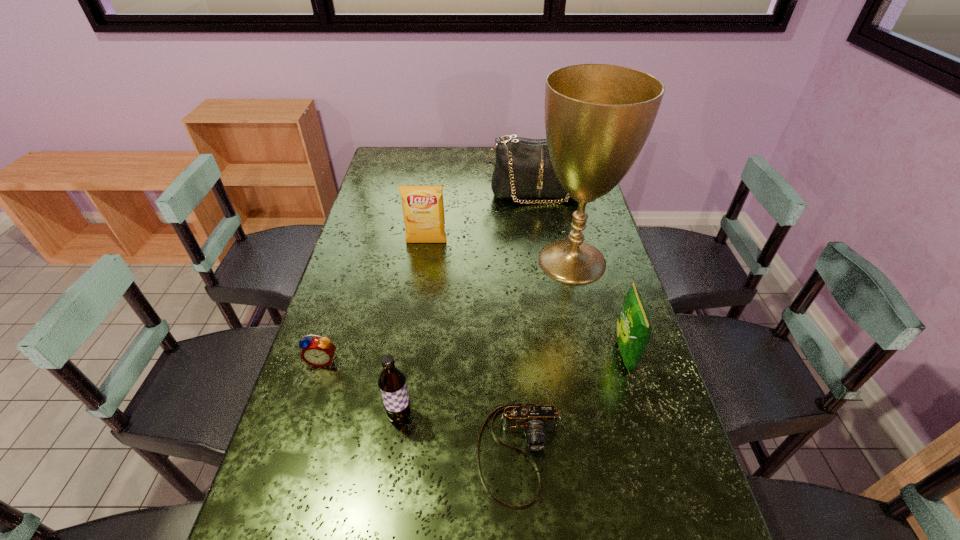
The width and height of the screenshot is (960, 540). I want to click on blank region between the right crisp (potato chip) and the trophy cup, so click(598, 307).

Where is `empty location between the left crisp (potato chip) and the shorter crisp (potato chip)`? This screenshot has width=960, height=540. empty location between the left crisp (potato chip) and the shorter crisp (potato chip) is located at coordinates (525, 299).

The height and width of the screenshot is (540, 960). What are the coordinates of `vacant space in between the handbag and the sixth tallest object` in the screenshot? It's located at pos(429,277).

Locate an element on the screen. The width and height of the screenshot is (960, 540). vacant area that lies between the nearer crisp (potato chip) and the tallest object is located at coordinates (598, 307).

I want to click on the fourth closest object to the shorter crisp (potato chip), so click(x=423, y=209).

Image resolution: width=960 pixels, height=540 pixels. In order to click on object that is the fifth closest one to the root beer in this screenshot , I will do `click(423, 209)`.

Where is `free space that satisfies the following two spatial constraints: 1. on the front-facing side of the nearer crisp (potato chip); 2. on the front-facing side of the leftmost object`? Image resolution: width=960 pixels, height=540 pixels. free space that satisfies the following two spatial constraints: 1. on the front-facing side of the nearer crisp (potato chip); 2. on the front-facing side of the leftmost object is located at coordinates (626, 360).

You are a GUI agent. You are given a task and a screenshot of the screen. Output one action in this format:
    pyautogui.click(x=<x>, y=<y>)
    Task: Click on the free point that satisfies the following two spatial constraints: 1. at the front of the trophy cup with chain and zipper; 2. on the left side of the farthest object
    The width and height of the screenshot is (960, 540).
    Given the screenshot: What is the action you would take?
    (x=547, y=261)

You are a GUI agent. You are given a task and a screenshot of the screen. Output one action in this format:
    pyautogui.click(x=<x>, y=<y>)
    Task: Click on the free spot that satisfies the following two spatial constraints: 1. at the front of the farthest object with chain and zipper; 2. on the right side of the tallest object
    This screenshot has width=960, height=540.
    Given the screenshot: What is the action you would take?
    pyautogui.click(x=547, y=261)

The image size is (960, 540). What are the coordinates of `vacant space that satisfies the following two spatial constraints: 1. on the front-facing side of the shorter crisp (potato chip); 2. on the front-facing side of the shortest object` in the screenshot? It's located at (x=653, y=453).